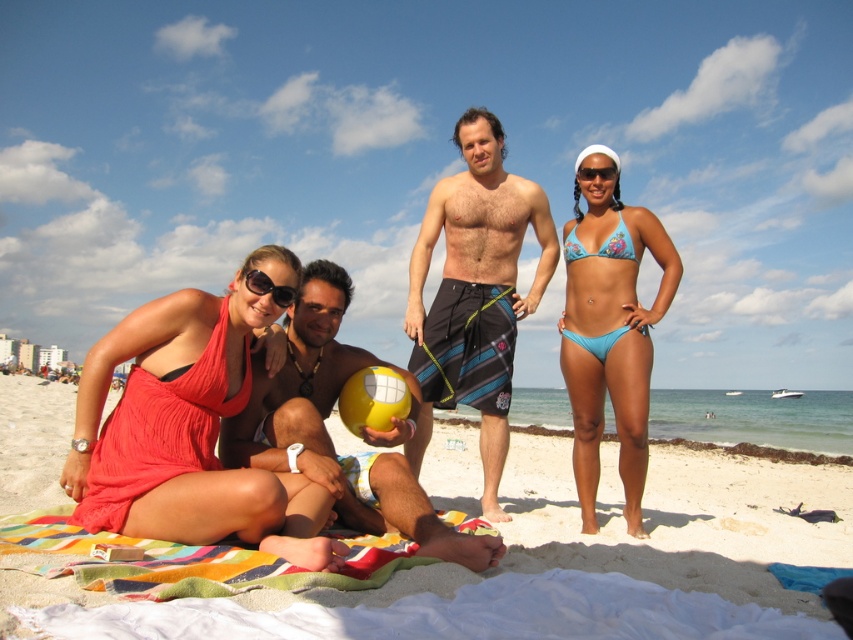
You are standing at the origin point in the beach scene. There are two points marked on the sand, one at coordinates point (433, 493) and another at point (389, 369). Which of these points is located further away from you?

Point (433, 493) is behind point (389, 369), so it is further away from you.